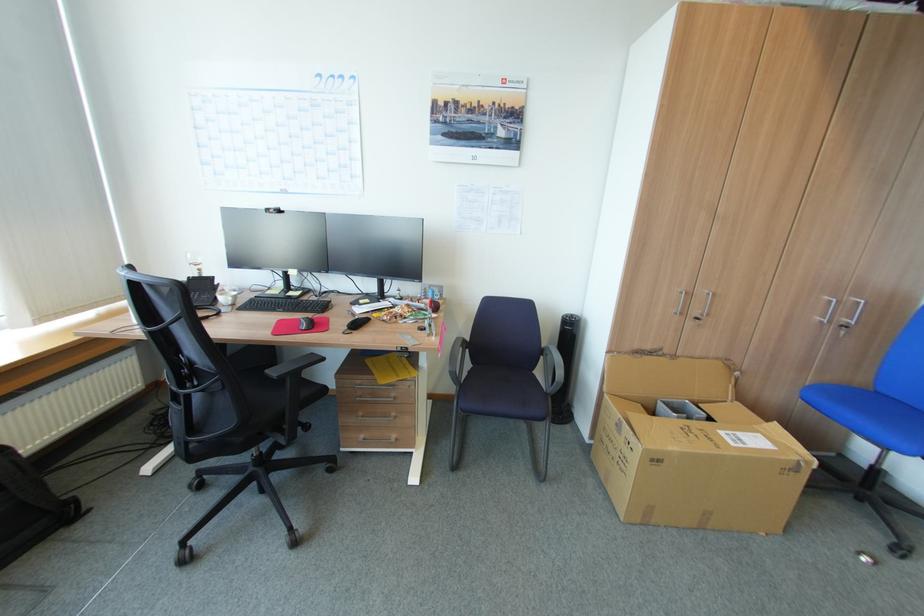
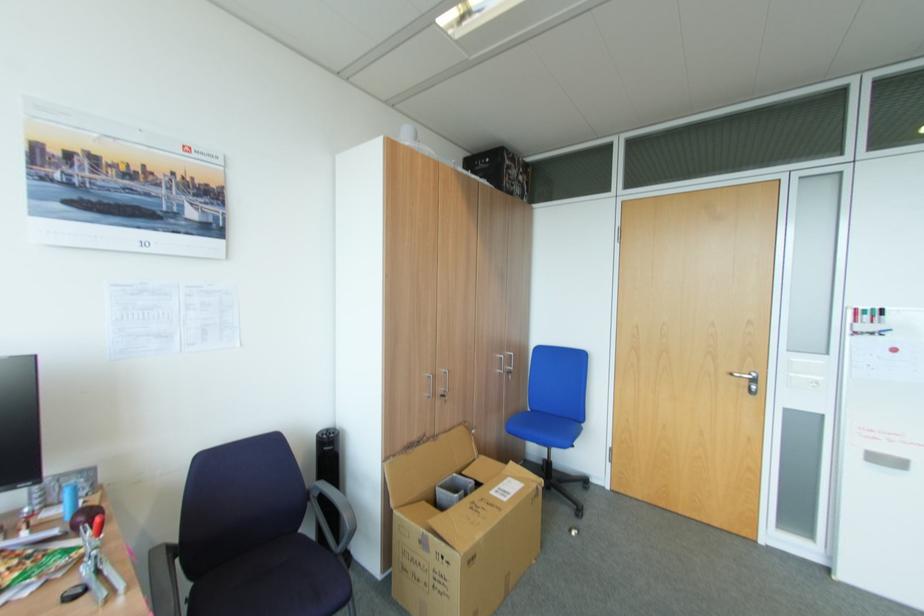
Locate, in the second image, the point that corresponds to point (546, 357) in the first image.

(313, 501)